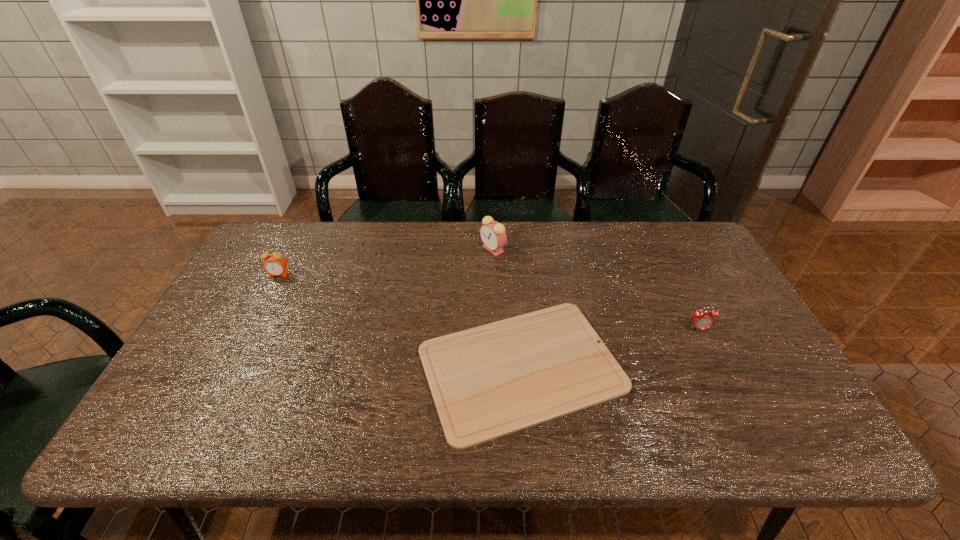
In the image, there is a desktop. Where is `vacant space at the right edge`? The height and width of the screenshot is (540, 960). vacant space at the right edge is located at coordinates (724, 288).

The width and height of the screenshot is (960, 540). In order to click on vacant region at the near left corner of the desktop in this screenshot , I will do `click(211, 433)`.

Image resolution: width=960 pixels, height=540 pixels. I want to click on free space that is in between the rightmost object and the second farthest alarm clock, so pos(489,302).

I want to click on empty space that is in between the chopping board and the nearest alarm clock, so click(611, 348).

The height and width of the screenshot is (540, 960). I want to click on blank region between the shortest object and the nearest alarm clock, so click(x=611, y=348).

Find the location of a particular element. The height and width of the screenshot is (540, 960). free area in between the third nearest object and the second alarm clock from left to right is located at coordinates (386, 262).

Find the location of a particular element. This screenshot has height=540, width=960. empty space between the leftmost alarm clock and the nearest alarm clock is located at coordinates (489, 302).

Locate an element on the screen. free space between the farthest alarm clock and the shortest object is located at coordinates (507, 308).

At what (x,y) coordinates should I click in order to perform the action: click on empty space between the rightmost alarm clock and the second alarm clock from left to right. Please return your answer as a coordinate pair (x, y). The height and width of the screenshot is (540, 960). Looking at the image, I should click on (596, 289).

You are a GUI agent. You are given a task and a screenshot of the screen. Output one action in this format:
    pyautogui.click(x=<x>, y=<y>)
    Task: Click on the free space between the third nearest object and the nearest alarm clock
    The height and width of the screenshot is (540, 960).
    Given the screenshot: What is the action you would take?
    pyautogui.click(x=489, y=302)